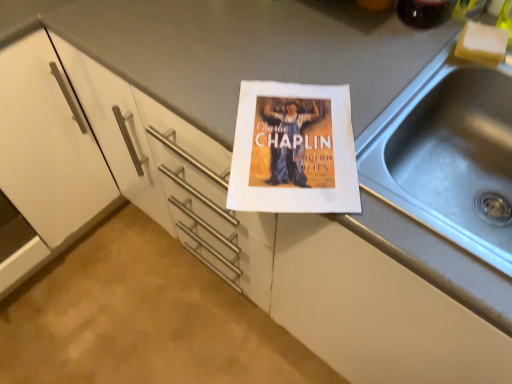
Locate an element on the screen. The height and width of the screenshot is (384, 512). vacant area situated to the left side of translucent glass beverage at upper right is located at coordinates (342, 29).